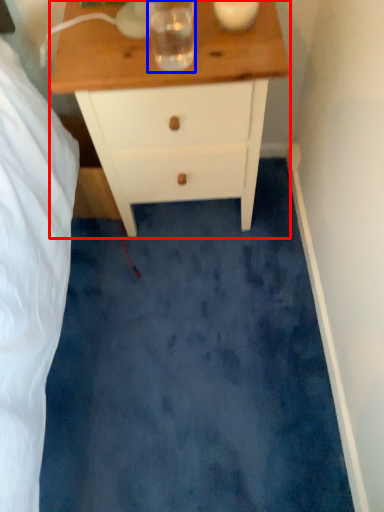
Question: Which point is closer to the camera, chest of drawers (highlighted by a red box) or beverage (highlighted by a blue box)?

Choices:
 (A) chest of drawers
 (B) beverage

Answer: (B)